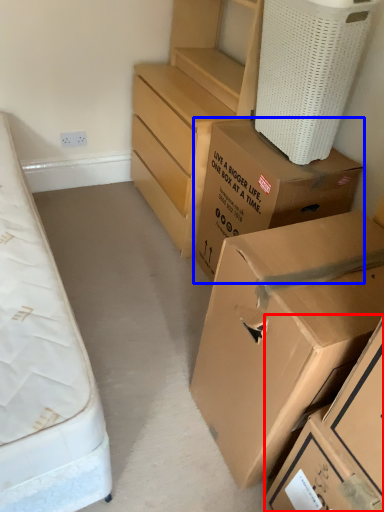
Question: Which object is further to the camera taking this photo, box (highlighted by a red box) or box (highlighted by a blue box)?

Choices:
 (A) box
 (B) box

Answer: (B)